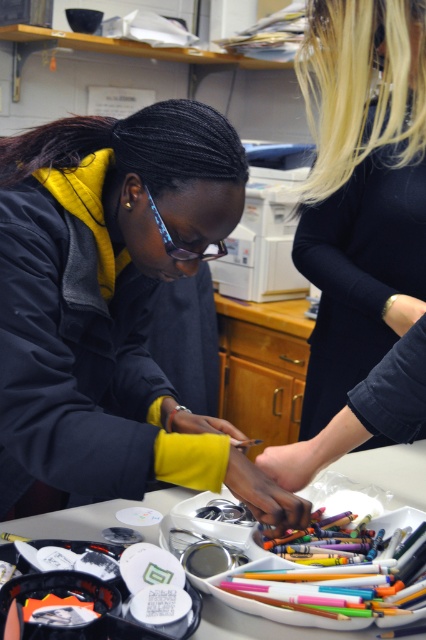
You are standing at the point labeled point (363, 376). You want to move to the door located at the opposite end of the room. Considering your height is 1.7 meters, will you be able to walk straight to the door without bending down?

The point labeled point (363, 376) and the viewer are 1.50 meters apart from each other. Since the distance between you and the point is only 1.50 meters, you can easily walk straight to the door without needing to bend down as there is no obstruction mentioned in the scene description.

You are a delivery robot with a 20 inch wide package. You need to place the package between the black matte shirt at upper right and the white plastic table at center. Is there enough space?

The distance between the black matte shirt at upper right and the white plastic table at center is 33.21 inches. Since the package is 20 inches wide, there is enough space to place it between them.

You are a student trying to reach the white plastic table at center to grab some supplies, but there is a black matte shirt at upper right in your way. Can you easily access the table?

The white plastic table at center is behind the black matte shirt at upper right, so you cannot easily access it without moving around the black matte shirt at upper right.